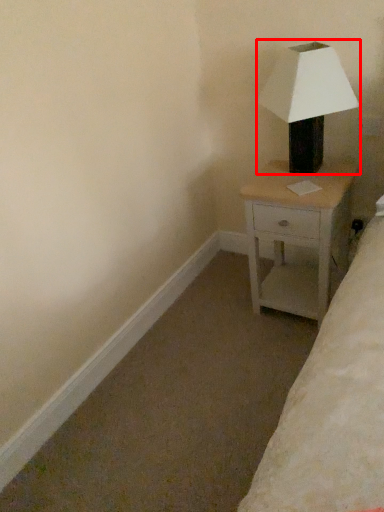
Question: In this image, where is lamp (annotated by the red box) located relative to nightstand?

Choices:
 (A) right
 (B) left

Answer: (B)